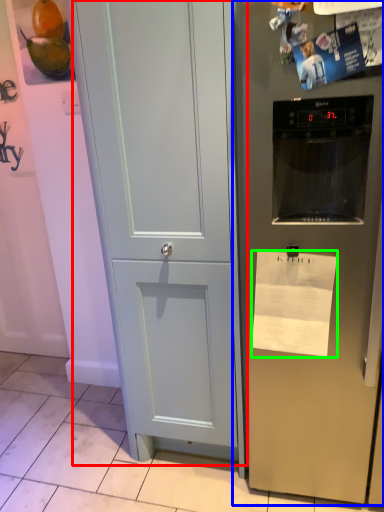
Question: Based on their relative distances, which object is nearer to door (highlighted by a red box)? Choose from refrigerator (highlighted by a blue box) and paper (highlighted by a green box).

Choices:
 (A) refrigerator
 (B) paper

Answer: (A)